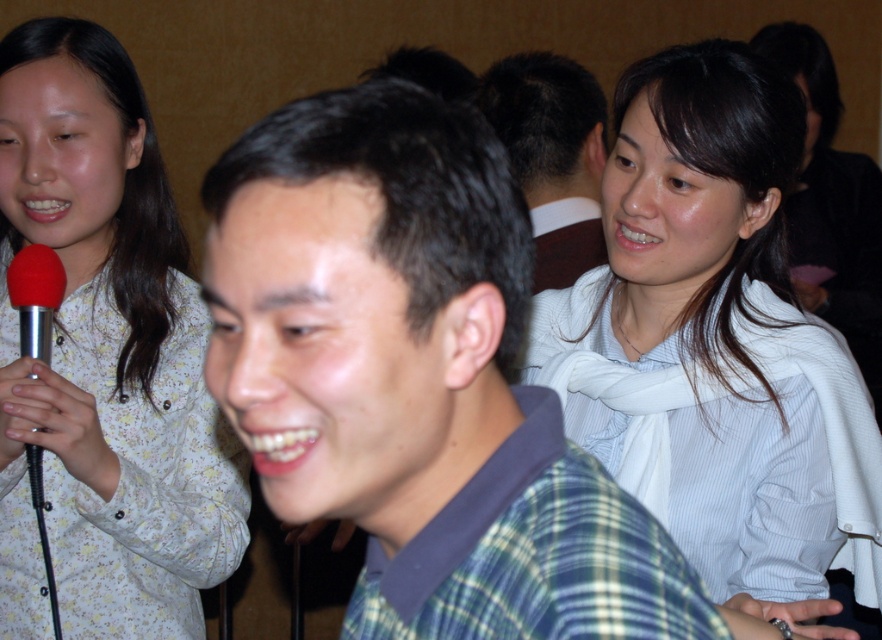
Question: Which point is closer to the camera?

Choices:
 (A) green plaid shirt at center
 (B) dark brown hair at upper right
 (C) white floral shirt at upper left

Answer: (A)

Question: Estimate the real-world distances between objects in this image. Which object is farther from the white floral shirt at upper left?

Choices:
 (A) green plaid shirt at center
 (B) red rubber microphone at left

Answer: (A)

Question: Which of these objects is positioned farthest from the green plaid shirt at center?

Choices:
 (A) white floral shirt at upper left
 (B) white striped shirt at upper right
 (C) dark brown hair at upper right

Answer: (C)

Question: Is white striped shirt at upper right below dark brown hair at upper right?

Choices:
 (A) yes
 (B) no

Answer: (A)

Question: Is green plaid shirt at center above red rubber microphone at left?

Choices:
 (A) no
 (B) yes

Answer: (B)

Question: Is white floral shirt at upper left positioned at the back of dark brown hair at upper right?

Choices:
 (A) no
 (B) yes

Answer: (A)